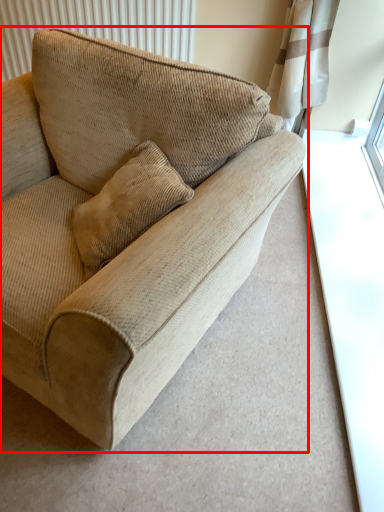
Question: Considering the relative positions of studio couch (annotated by the red box) and radiator in the image provided, where is studio couch (annotated by the red box) located with respect to the staircase?

Choices:
 (A) right
 (B) left

Answer: (A)